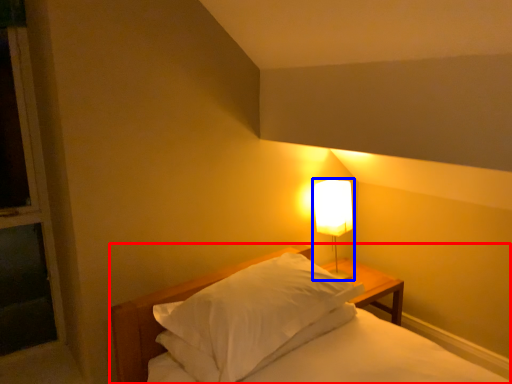
Question: Which of the following is the closest to the observer, bed (highlighted by a red box) or lamp (highlighted by a blue box)?

Choices:
 (A) bed
 (B) lamp

Answer: (A)